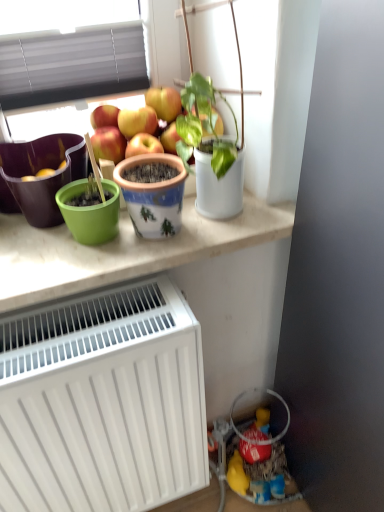
Locate an element on the screen. vacant space in front of green matte flowerpot at left, which is the 2th flowerpot in right-to-left order is located at coordinates tap(53, 263).